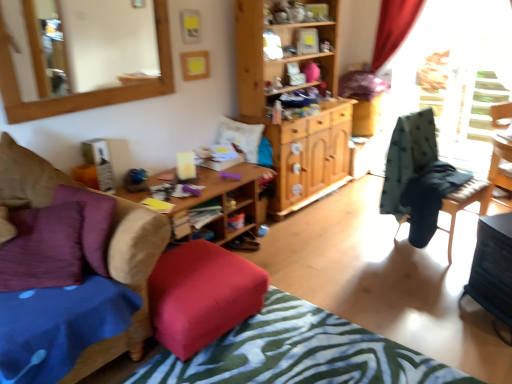
Question: Looking at their shapes, would you say white soft pillow at center, the second pillow in the left-to-right sequence, is wider or thinner than green fabric chair at right?

Choices:
 (A) thin
 (B) wide

Answer: (B)

Question: From the image's perspective, is white soft pillow at center, the 1th pillow from the right, positioned above or below green fabric chair at right?

Choices:
 (A) above
 (B) below

Answer: (B)

Question: Estimate the real-world distances between objects in this image. Which object is closer to the velvet red stool at center?

Choices:
 (A) wooden-framed mirror at upper left
 (B) wooden desk at center
 (C) purple velvet pillow at left, which is the second pillow in right-to-left order
 (D) black glossy table at lower right
 (E) white soft pillow at center, acting as the 2th pillow starting from the front

Answer: (B)

Question: Which object is the closest to the black glossy table at lower right?

Choices:
 (A) wooden cabinet at center
 (B) white soft pillow at center, the 1th pillow from the right
 (C) textured green and white bedspread at lower center
 (D) wooden desk at center
 (E) velvet cushion at lower left, which is counted as the second chair, starting from the back

Answer: (C)